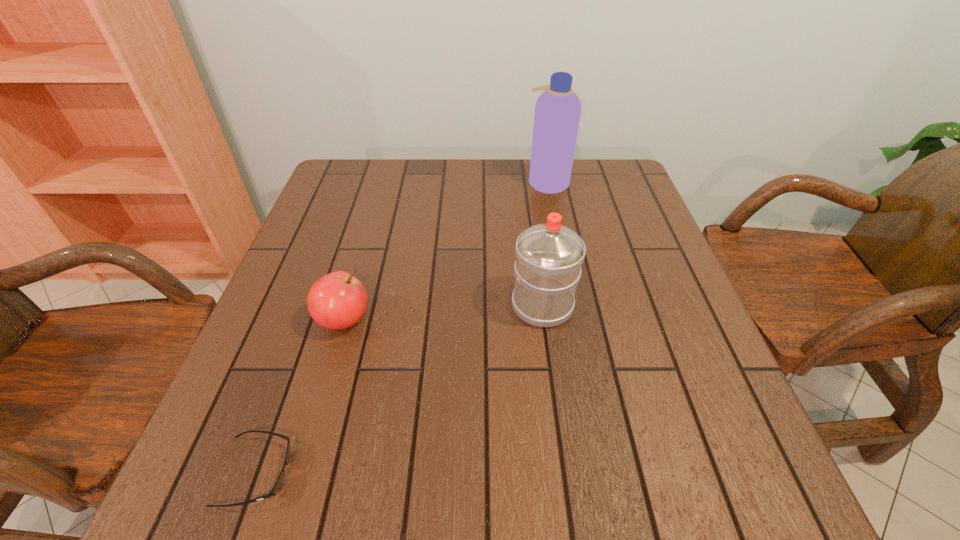
This screenshot has height=540, width=960. In order to click on free space at the right edge in this screenshot , I will do `click(605, 264)`.

Identify the location of free region at the far left corner of the desktop. The image size is (960, 540). (335, 190).

Where is `free region at the far right corner of the desktop`? free region at the far right corner of the desktop is located at coordinates (579, 158).

Where is `free space at the near right corner of the desktop`? Image resolution: width=960 pixels, height=540 pixels. free space at the near right corner of the desktop is located at coordinates (770, 469).

This screenshot has width=960, height=540. What are the coordinates of `vacant point located between the shortest object and the apple` in the screenshot? It's located at (300, 396).

This screenshot has width=960, height=540. In order to click on free space between the apple and the shampoo in this screenshot , I will do `click(445, 251)`.

You are a GUI agent. You are given a task and a screenshot of the screen. Output one action in this format:
    pyautogui.click(x=<x>, y=<y>)
    Task: Click on the free space between the third shortest object and the nearest object
    This screenshot has height=540, width=960.
    Given the screenshot: What is the action you would take?
    click(x=399, y=389)

You are a GUI agent. You are given a task and a screenshot of the screen. Output one action in this format:
    pyautogui.click(x=<x>, y=<y>)
    Task: Click on the vacant point located between the second tallest object and the sunglasses
    
    Given the screenshot: What is the action you would take?
    pyautogui.click(x=399, y=389)

Identify the location of free area in between the shortest object and the tallest object. The width and height of the screenshot is (960, 540). (402, 327).

Locate an element on the screen. The width and height of the screenshot is (960, 540). free area in between the shampoo and the third tallest object is located at coordinates (445, 251).